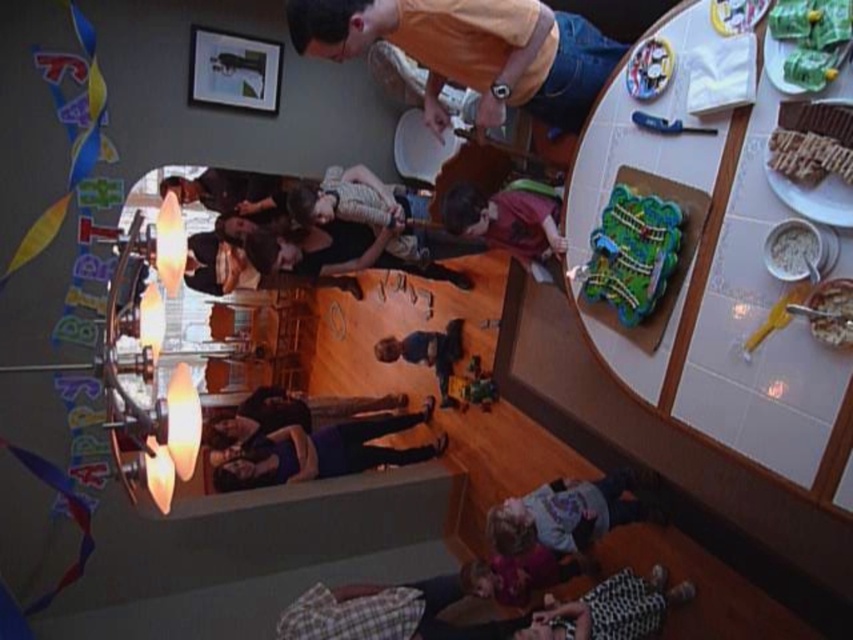
You are standing at the entrance of the room and want to place a gift box on the plaid fabric at lower center. According to the coordinates provided, where should you aim to place the gift box?

The plaid fabric at lower center is located at coordinates point (610, 609), so you should aim for that specific point to place the gift box there.